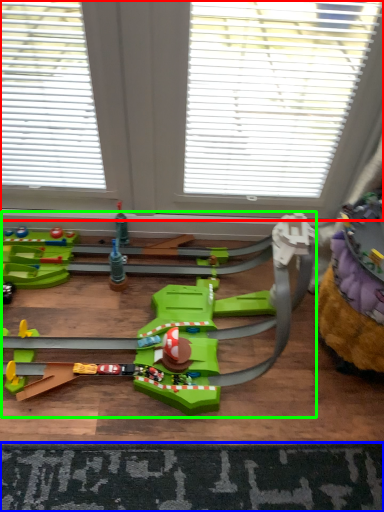
Question: Which object is the farthest from window (highlighted by a red box)? Choose among these: mat (highlighted by a blue box) or toy (highlighted by a green box).

Choices:
 (A) mat
 (B) toy

Answer: (A)